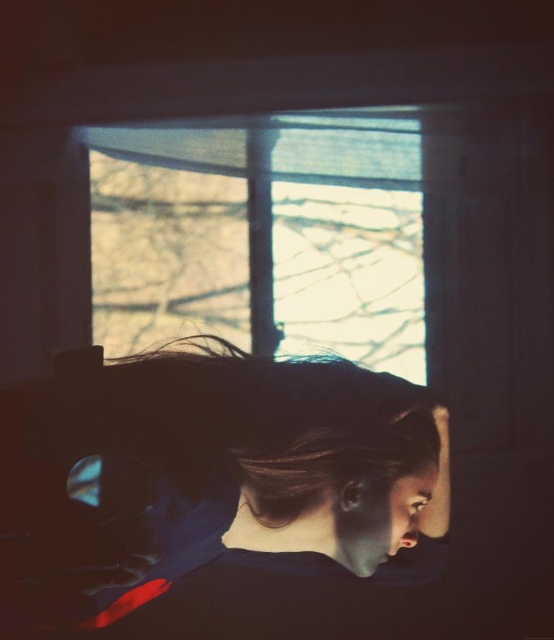
Question: Is matte black hair at center to the right of translucent glass window at upper center from the viewer's perspective?

Choices:
 (A) no
 (B) yes

Answer: (A)

Question: Can you confirm if matte black hair at center is bigger than translucent glass window at upper center?

Choices:
 (A) no
 (B) yes

Answer: (B)

Question: Does matte black hair at center have a smaller size compared to translucent glass window at upper center?

Choices:
 (A) yes
 (B) no

Answer: (B)